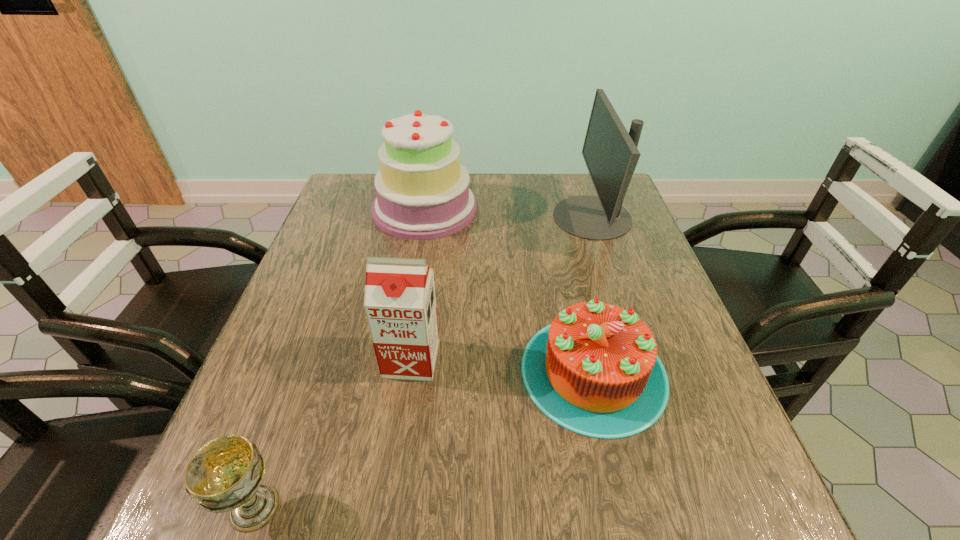
Image resolution: width=960 pixels, height=540 pixels. In the image, there is a desktop. In order to click on free space at the near edge in this screenshot , I will do `click(460, 502)`.

The image size is (960, 540). In the image, there is a desktop. In order to click on vacant space at the left edge in this screenshot , I will do `click(324, 316)`.

At what (x,y) coordinates should I click in order to perform the action: click on vacant space at the right edge of the desktop. Please return your answer as a coordinate pair (x, y). The width and height of the screenshot is (960, 540). Looking at the image, I should click on (682, 422).

Where is `vacant space at the near right corner`? vacant space at the near right corner is located at coordinates (728, 492).

Find the location of a particular element. The height and width of the screenshot is (540, 960). empty location between the shorter cake and the taller cake is located at coordinates (509, 290).

Where is `vacant region between the right cake and the soya milk`? Image resolution: width=960 pixels, height=540 pixels. vacant region between the right cake and the soya milk is located at coordinates (502, 365).

Identify the location of free space between the nearer cake and the taller cake. Image resolution: width=960 pixels, height=540 pixels. (509, 290).

I want to click on vacant point located between the soya milk and the computer monitor, so click(502, 288).

At what (x,y) coordinates should I click in order to perform the action: click on free space between the soya milk and the nearer cake. Please return your answer as a coordinate pair (x, y). The height and width of the screenshot is (540, 960). Looking at the image, I should click on (502, 365).

This screenshot has height=540, width=960. I want to click on vacant space in between the soya milk and the computer monitor, so click(x=502, y=288).